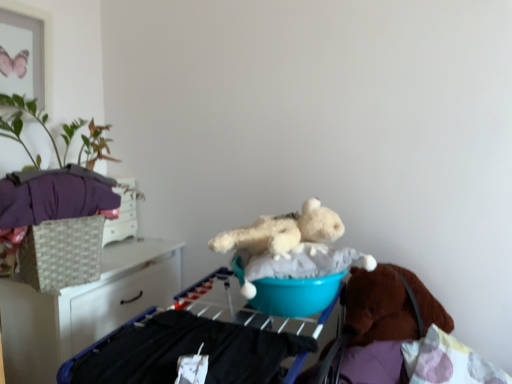
Question: Is blue plastic basin at center wider or thinner than green leafy plant at upper left?

Choices:
 (A) thin
 (B) wide

Answer: (A)

Question: In terms of size, does blue plastic basin at center appear bigger or smaller than green leafy plant at upper left?

Choices:
 (A) small
 (B) big

Answer: (A)

Question: Estimate the real-world distances between objects in this image. Which object is closer to the white wicker basket at left?

Choices:
 (A) green leafy plant at upper left
 (B) purple fleece glove at left
 (C) woven beige basket at left
 (D) blue plastic basin at center
 (E) teal plastic bucket at center

Answer: (C)

Question: Which of these objects is positioned closest to the blue plastic basin at center?

Choices:
 (A) fluffy white teddy bear at center
 (B) green leafy plant at upper left
 (C) teal plastic bucket at center
 (D) purple fleece glove at left
 (E) white wicker basket at left

Answer: (A)